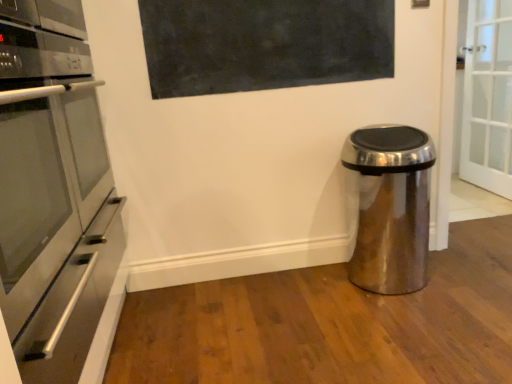
Locate an element on the screen. This screenshot has width=512, height=384. free space in front of satin metallic trash can at lower right is located at coordinates (415, 319).